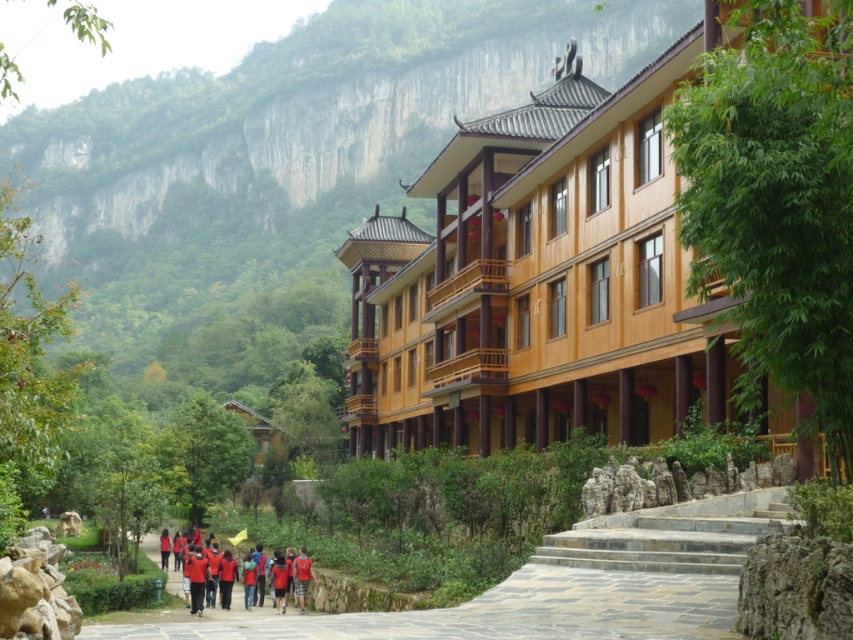
Question: Which point is farther to the camera?

Choices:
 (A) red fabric group at center
 (B) smooth stone pathway at center

Answer: (A)

Question: Can you confirm if smooth stone pathway at center is positioned to the left of red fabric group at center?

Choices:
 (A) no
 (B) yes

Answer: (A)

Question: Which object appears farthest from the camera in this image?

Choices:
 (A) smooth stone pathway at center
 (B) red fabric group at center

Answer: (B)

Question: Is smooth stone pathway at center thinner than red fabric group at center?

Choices:
 (A) no
 (B) yes

Answer: (A)

Question: Considering the relative positions of smooth stone pathway at center and red fabric group at center in the image provided, where is smooth stone pathway at center located with respect to red fabric group at center?

Choices:
 (A) right
 (B) left

Answer: (A)